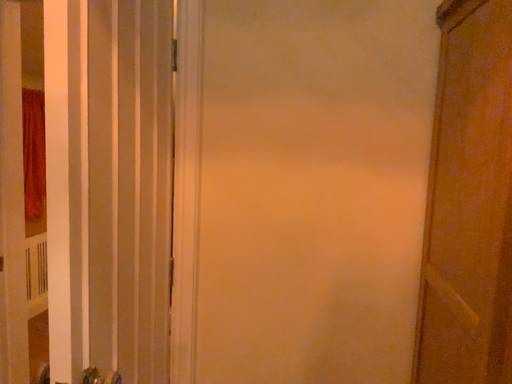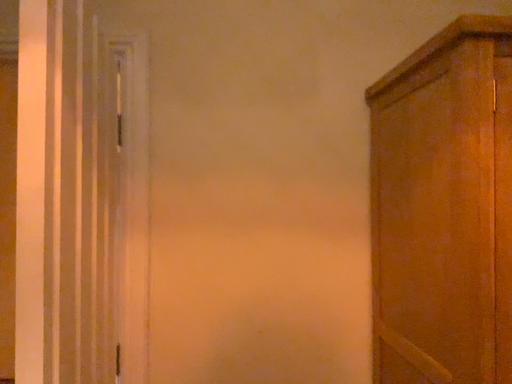
Question: Which way did the camera rotate in the video?

Choices:
 (A) rotated right
 (B) rotated left

Answer: (A)